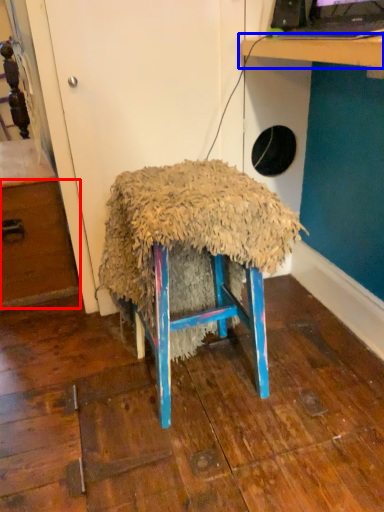
Question: Which object is further to the camera taking this photo, drawer (highlighted by a red box) or table (highlighted by a blue box)?

Choices:
 (A) drawer
 (B) table

Answer: (A)